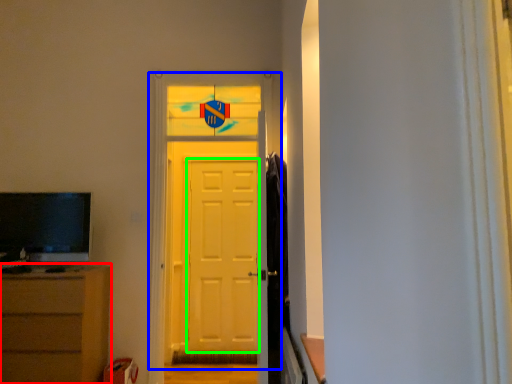
Question: Considering the real-world distances, which object is farthest from chest of drawers (highlighted by a red box)? door (highlighted by a blue box) or screen door (highlighted by a green box)?

Choices:
 (A) door
 (B) screen door

Answer: (B)